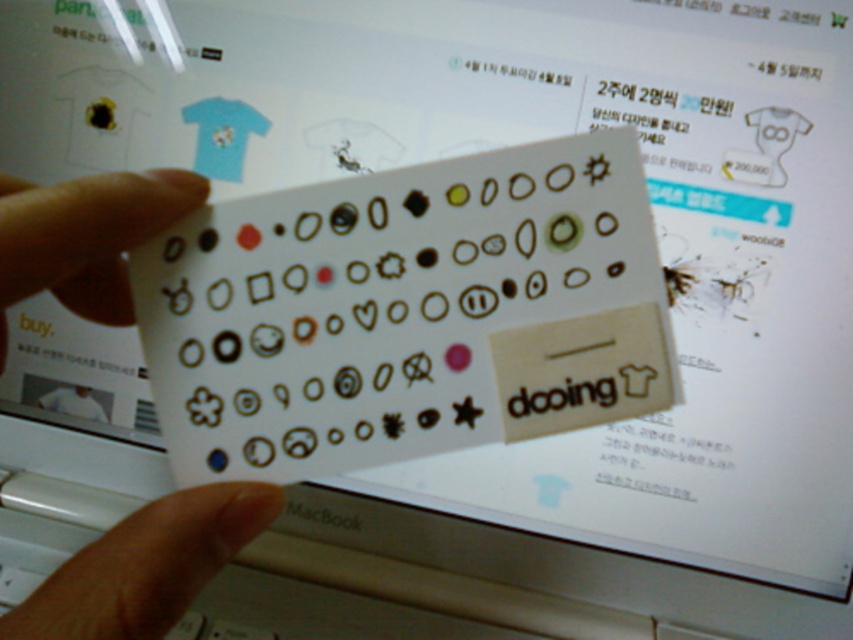
Based on the photo, who is positioned more to the right, translucent plastic hand at center or matte plastic hand at center?

Positioned to the right is translucent plastic hand at center.

Can you confirm if translucent plastic hand at center is positioned to the left of matte plastic hand at center?

No, translucent plastic hand at center is not to the left of matte plastic hand at center.

Is point (175, 604) behind point (155, 234)?

No, it is in front of (155, 234).

The width and height of the screenshot is (853, 640). I want to click on translucent plastic hand at center, so click(x=146, y=564).

Can you confirm if translucent plastic hand at center is taller than skinny flesh-colored hand at lower left?

Yes.

Who is shorter, translucent plastic hand at center or skinny flesh-colored hand at lower left?

With less height is skinny flesh-colored hand at lower left.

Which is behind, point (39, 620) or point (135, 611)?

The point (135, 611) is behind.

Find the location of a particular element. This screenshot has width=853, height=640. translucent plastic hand at center is located at coordinates (146, 564).

Does skinny flesh-colored hand at lower left lie behind matte plastic hand at center?

No, it is in front of matte plastic hand at center.

Can you confirm if skinny flesh-colored hand at lower left is positioned below matte plastic hand at center?

Correct, skinny flesh-colored hand at lower left is located below matte plastic hand at center.

Does point (178, 573) lie behind point (172, 173)?

No, (178, 573) is closer to viewer.

Locate an element on the screen. The width and height of the screenshot is (853, 640). skinny flesh-colored hand at lower left is located at coordinates (146, 564).